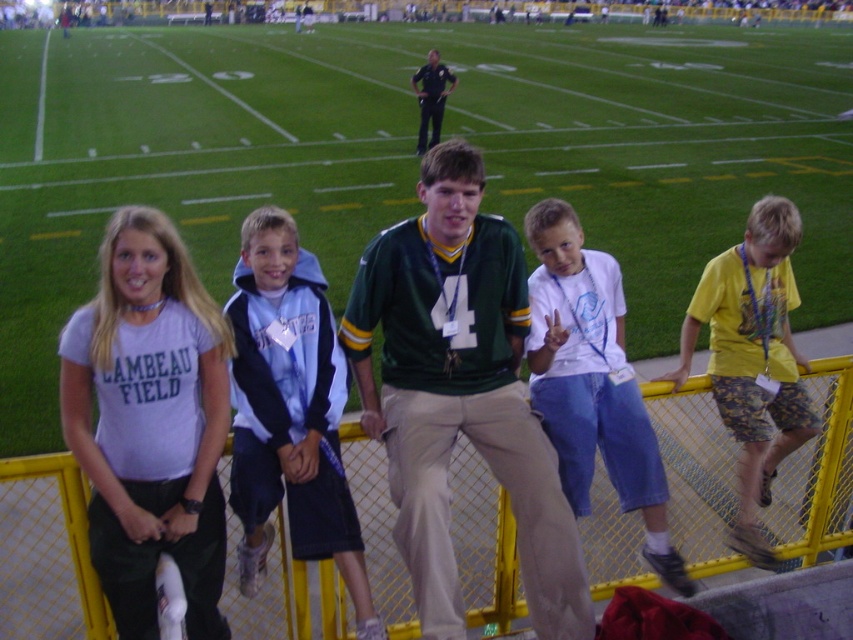
You are a photographer trying to capture a group photo of the green jersey at center and the blue fleece jacket at center. The camera you are using has a minimum focus distance of 18 inches. Can you take a photo of both subjects without moving them?

The distance between the green jersey at center and blue fleece jacket at center is 18.67 inches, which is greater than the camera minimum focus distance of 18 inches. Therefore, you can take a photo of both subjects without moving them.

Based on the scene description, where is the green jersey at center positioned in relation to the other individuals?

The green jersey at center is positioned at the coordinates point (459, 394).